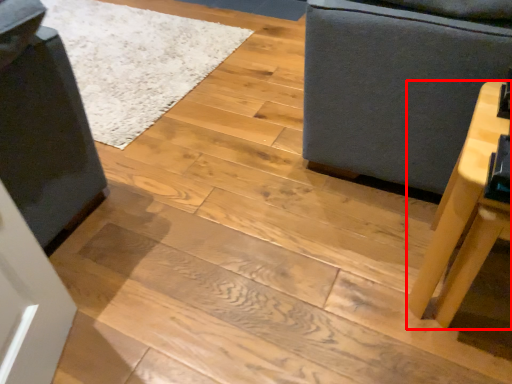
Question: From the image's perspective, where is table (annotated by the red box) located relative to furniture?

Choices:
 (A) above
 (B) below

Answer: (B)